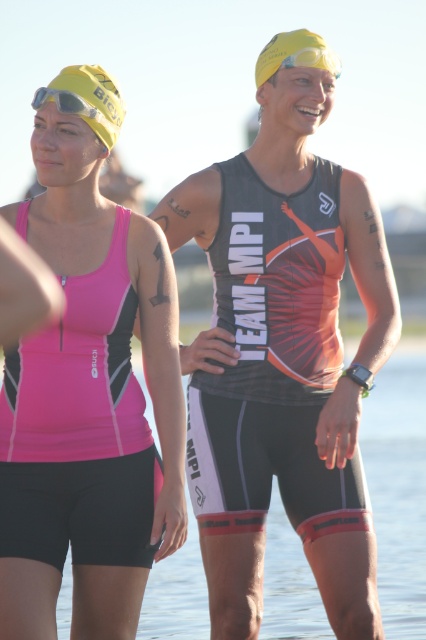
Between black matte triathlon suit at center and matte black goggles at upper left, which one has more height?

black matte triathlon suit at center

Looking at this image, does black matte triathlon suit at center have a lesser height compared to matte black goggles at upper left?

In fact, black matte triathlon suit at center may be taller than matte black goggles at upper left.

Does point (331, 314) come in front of point (77, 109)?

That is False.

Where is `black matte triathlon suit at center`? The image size is (426, 640). black matte triathlon suit at center is located at coordinates (273, 362).

Does point (241, 428) come in front of point (296, 51)?

Yes, point (241, 428) is in front of point (296, 51).

Describe the element at coordinates (273, 362) in the screenshot. This screenshot has height=640, width=426. I see `black matte triathlon suit at center` at that location.

Locate an element on the screen. The height and width of the screenshot is (640, 426). black matte triathlon suit at center is located at coordinates (273, 362).

Between matte black triathlon suit at center and black matte triathlon suit at center, which one appears on the right side from the viewer's perspective?

matte black triathlon suit at center is more to the right.

Which is below, matte black triathlon suit at center or black matte triathlon suit at center?

matte black triathlon suit at center is lower down.

The height and width of the screenshot is (640, 426). I want to click on matte black triathlon suit at center, so click(x=285, y=349).